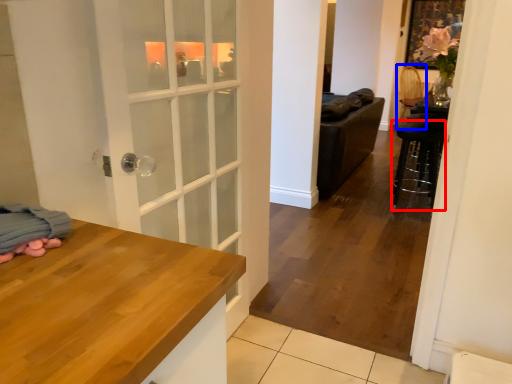
Question: Which object appears farthest to the camera in this image, bar stool (highlighted by a red box) or armchair (highlighted by a blue box)?

Choices:
 (A) bar stool
 (B) armchair

Answer: (B)